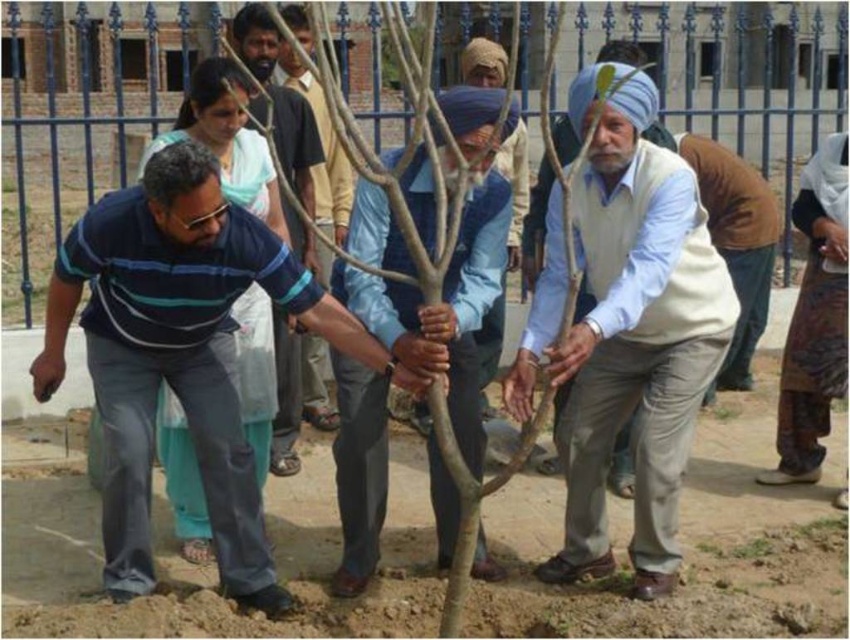
You are a photographer standing 50 feet away from the scene. You want to take a photo of both the light beige cotton shirt at center and the matte blue shirt at center in the same frame. Will you be able to capture both in a single shot if your camera has a 50mm lens?

The light beige cotton shirt at center and the matte blue shirt at center are 48.43 feet apart from each other. Since the photographer is 50 feet away, the 50mm lens should be able to capture both in a single frame as the distance between them is less than the photographer distance.

You are a drone operator trying to capture a photo of the striped cotton shirt at center. What are the coordinates where you should aim your camera?

The striped cotton shirt at center is located at point (180,355), so aim your camera there to capture it.

What is the color of the shirt worn by the individual at the coordinate point (627,337)?

The point (627,337) corresponds to the light beige cotton shirt at center, so the color is light beige.